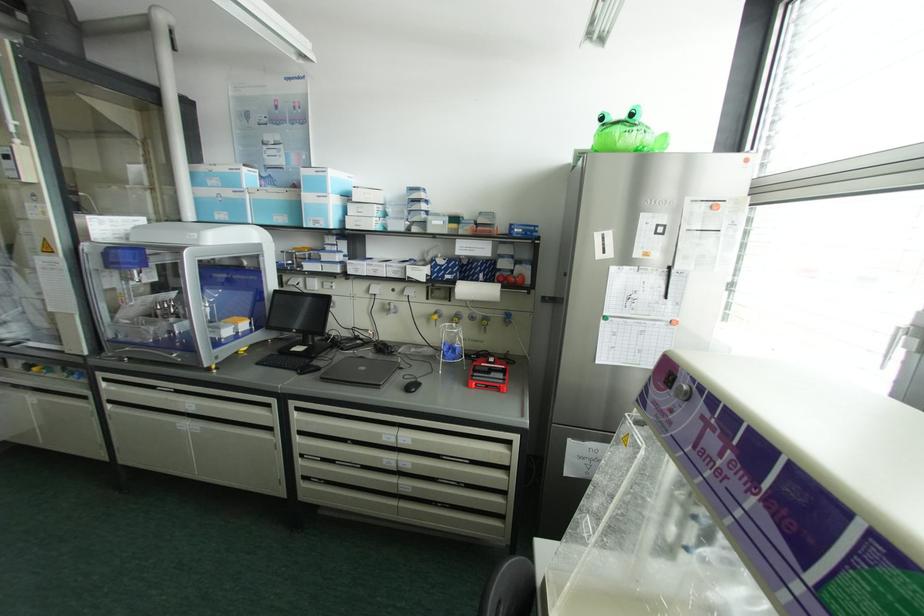
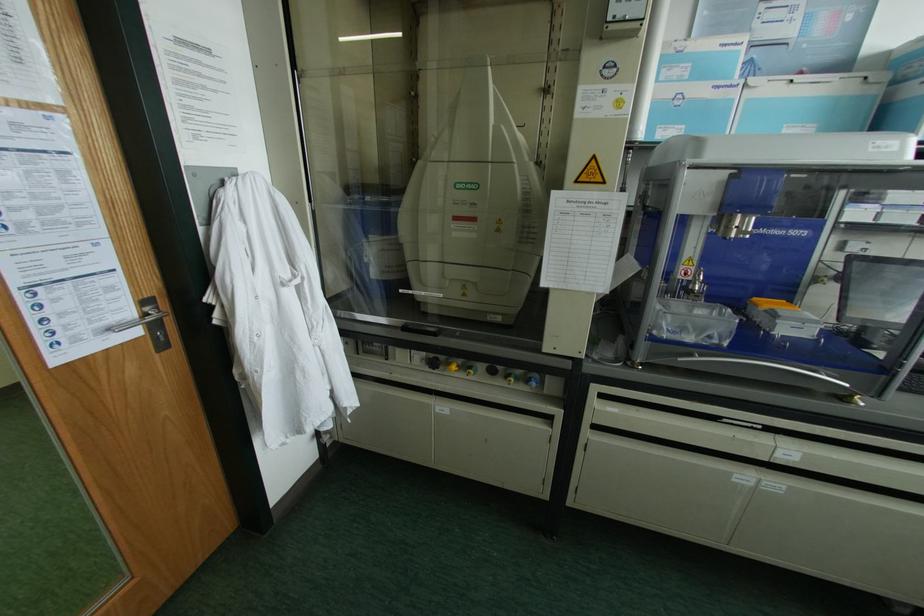
Question: In a continuous first-person perspective shot, in which direction is the camera moving?

Choices:
 (A) Left
 (B) Right
 (C) Forward
 (D) Backward

Answer: (A)